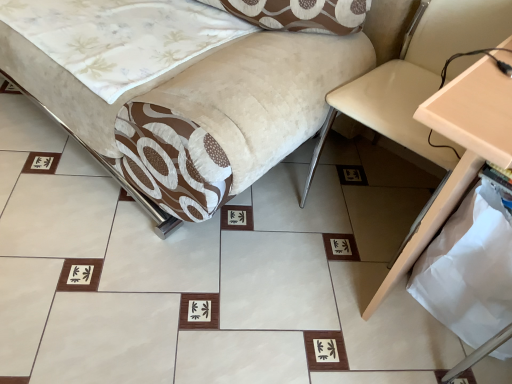
Question: Would you say beige leather swivel chair at right is a long distance from beige wood table at right?

Choices:
 (A) yes
 (B) no

Answer: (B)

Question: From a real-world perspective, does beige leather swivel chair at right sit lower than beige wood table at right?

Choices:
 (A) yes
 (B) no

Answer: (A)

Question: Considering the relative sizes of beige leather swivel chair at right and beige wood table at right in the image provided, is beige leather swivel chair at right thinner than beige wood table at right?

Choices:
 (A) no
 (B) yes

Answer: (B)

Question: From the image's perspective, is beige leather swivel chair at right over beige wood table at right?

Choices:
 (A) yes
 (B) no

Answer: (A)

Question: Can you confirm if beige leather swivel chair at right is positioned to the left of beige wood table at right?

Choices:
 (A) no
 (B) yes

Answer: (B)

Question: Would you say beige leather swivel chair at right is inside or outside velvet beige sofa at center?

Choices:
 (A) outside
 (B) inside

Answer: (A)

Question: From the image's perspective, is beige leather swivel chair at right located above or below velvet beige sofa at center?

Choices:
 (A) below
 (B) above

Answer: (A)

Question: Looking at the image, does beige leather swivel chair at right seem bigger or smaller compared to velvet beige sofa at center?

Choices:
 (A) big
 (B) small

Answer: (B)

Question: From a real-world perspective, is beige leather swivel chair at right above or below velvet beige sofa at center?

Choices:
 (A) below
 (B) above

Answer: (A)

Question: From a real-world perspective, is beige wood table at right above or below velvet beige sofa at center?

Choices:
 (A) above
 (B) below

Answer: (A)

Question: Based on their sizes in the image, would you say beige wood table at right is bigger or smaller than velvet beige sofa at center?

Choices:
 (A) small
 (B) big

Answer: (A)

Question: Visually, is beige wood table at right positioned to the left or to the right of velvet beige sofa at center?

Choices:
 (A) left
 (B) right

Answer: (B)

Question: Choose the correct answer: Is beige wood table at right inside velvet beige sofa at center or outside it?

Choices:
 (A) inside
 (B) outside

Answer: (B)

Question: From the image's perspective, is beige leather swivel chair at right positioned above or below beige wood table at right?

Choices:
 (A) above
 (B) below

Answer: (A)

Question: Looking at the image, does beige leather swivel chair at right seem bigger or smaller compared to beige wood table at right?

Choices:
 (A) small
 (B) big

Answer: (A)